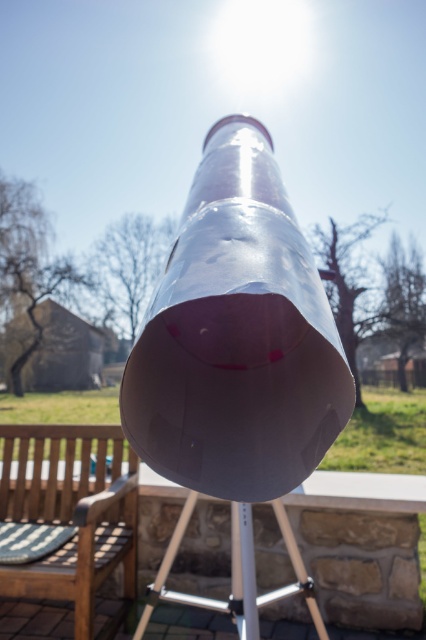
Between glossy metallic telescope at center and metallic silver picnic table at center, which one has more height?

glossy metallic telescope at center is taller.

Which is behind, point (264, 131) or point (250, 577)?

Positioned behind is point (250, 577).

Does point (203, 147) lie in front of point (161, 566)?

Yes, point (203, 147) is closer to viewer.

This screenshot has width=426, height=640. Identify the location of glossy metallic telescope at center. (238, 358).

Based on the photo, can you confirm if wooden slats bench at lower left is positioned to the right of metallic silver picnic table at center?

Incorrect, wooden slats bench at lower left is not on the right side of metallic silver picnic table at center.

Does point (45, 433) come closer to viewer compared to point (305, 593)?

That is False.

Is point (95, 563) farther from viewer compared to point (218, 605)?

Yes, point (95, 563) is behind point (218, 605).

Locate an element on the screen. The width and height of the screenshot is (426, 640). wooden slats bench at lower left is located at coordinates (65, 528).

Can you confirm if glossy metallic telescope at center is taller than wooden slats bench at lower left?

No, glossy metallic telescope at center is not taller than wooden slats bench at lower left.

Can you confirm if glossy metallic telescope at center is positioned above wooden slats bench at lower left?

Indeed, glossy metallic telescope at center is positioned over wooden slats bench at lower left.

The width and height of the screenshot is (426, 640). I want to click on glossy metallic telescope at center, so pos(238,358).

Identify the location of glossy metallic telescope at center. (238, 358).